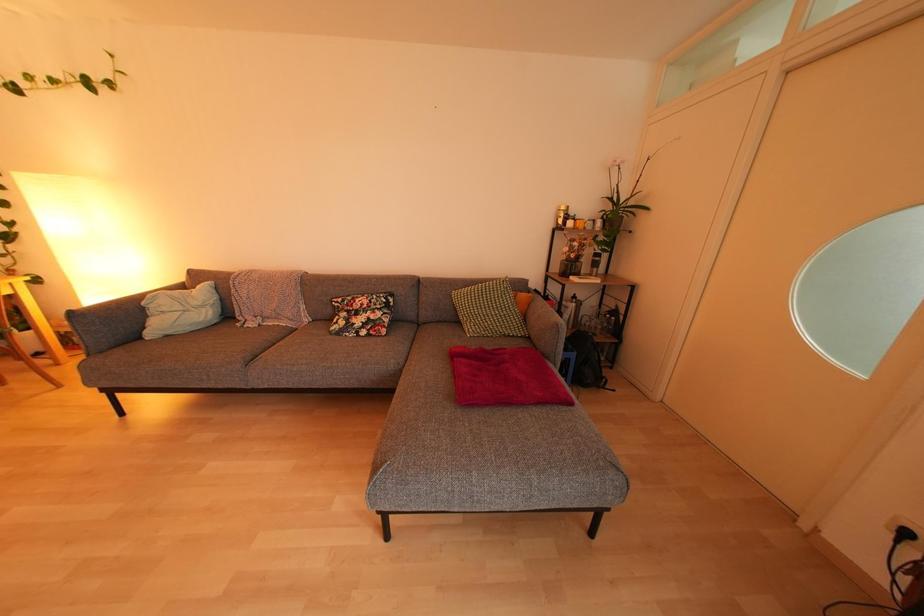
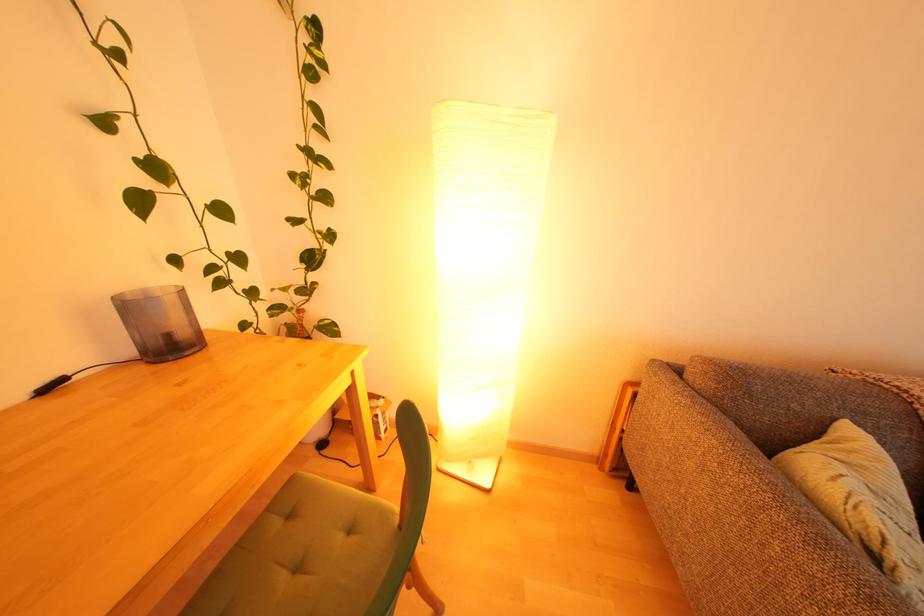
What movement of the cameraman would produce the second image?

The cameraman moved toward left, forward.